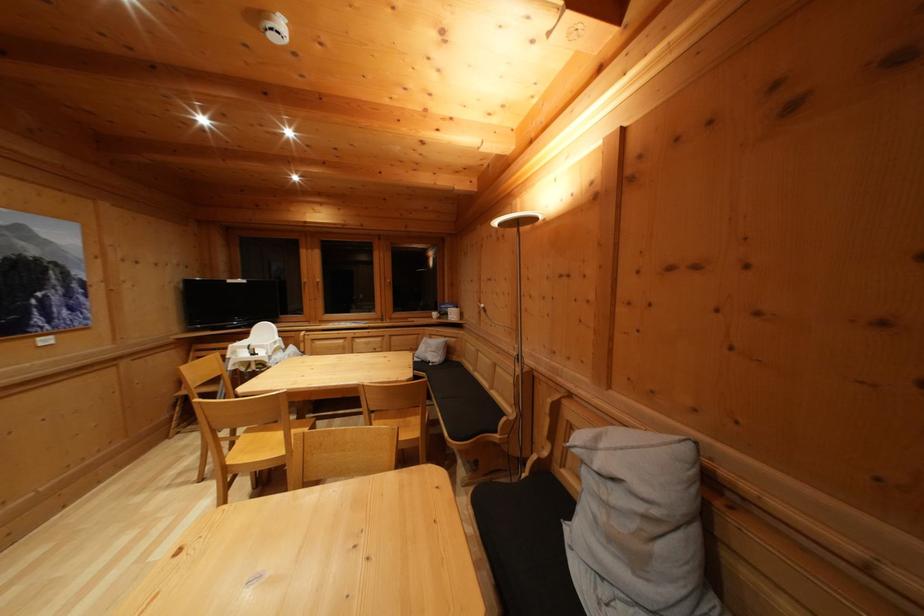
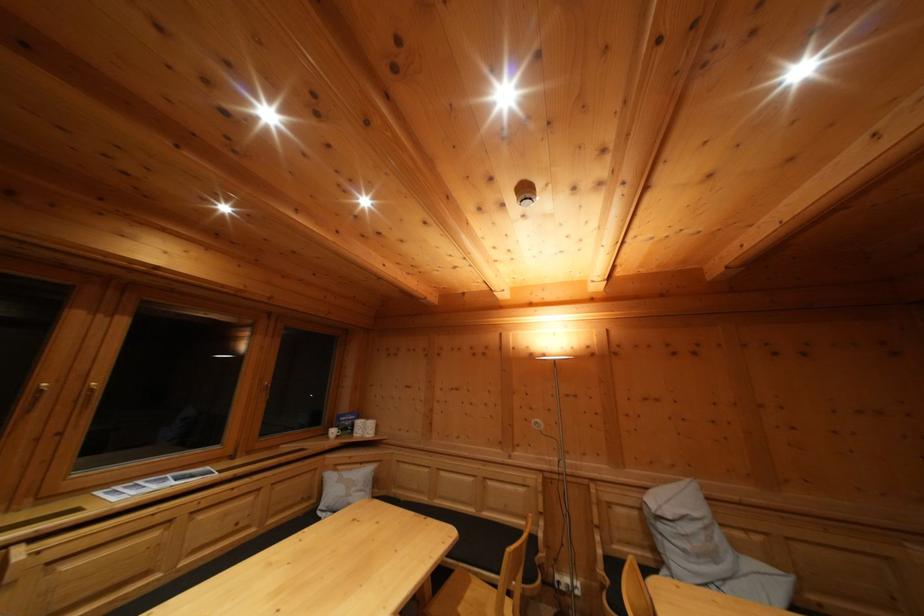
In the second image, find the point that corresponds to pixel 517 414 in the first image.

(532, 525)